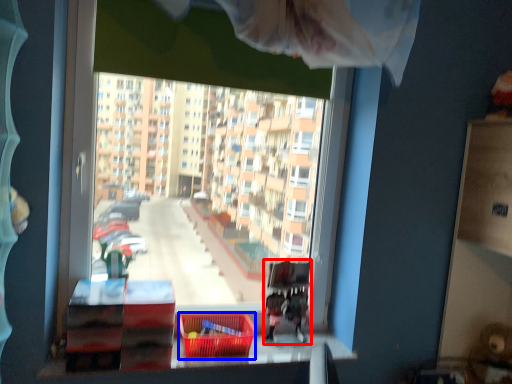
Question: Which of the following is the farthest to the observer, bunk bed (highlighted by a red box) or basket (highlighted by a blue box)?

Choices:
 (A) bunk bed
 (B) basket

Answer: (A)